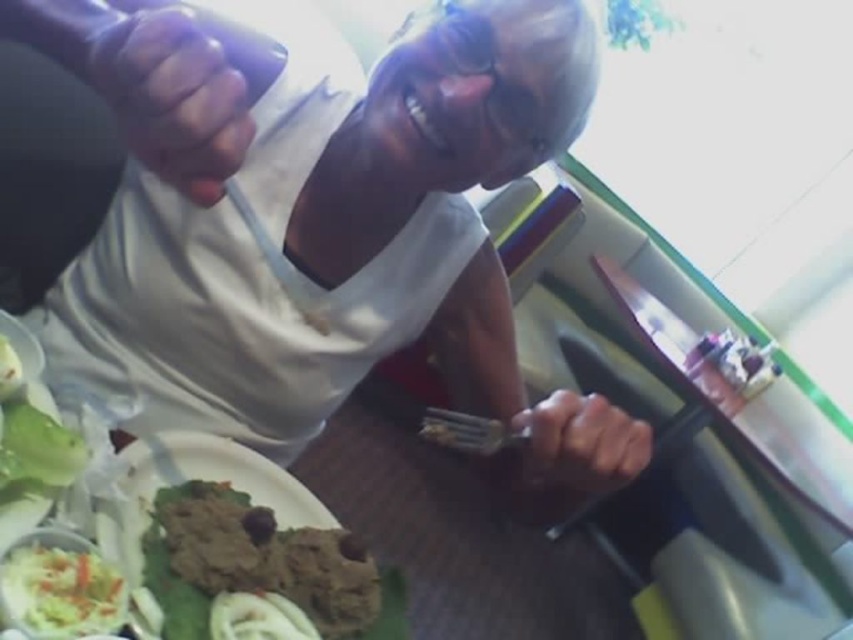
Does white matte shirt at upper center have a greater width compared to smooth skin hand at lower center?

Yes, white matte shirt at upper center is wider than smooth skin hand at lower center.

This screenshot has height=640, width=853. What do you see at coordinates (305, 205) in the screenshot? I see `white matte shirt at upper center` at bounding box center [305, 205].

Image resolution: width=853 pixels, height=640 pixels. In order to click on white matte shirt at upper center in this screenshot , I will do `click(305, 205)`.

From the picture: Can you confirm if brown matte food at lower left is smaller than wooden table at center?

Indeed, brown matte food at lower left has a smaller size compared to wooden table at center.

Does point (219, 484) come farther from viewer compared to point (808, 488)?

No, (219, 484) is in front of (808, 488).

Find the location of a particular element. The width and height of the screenshot is (853, 640). brown matte food at lower left is located at coordinates (252, 563).

Consider the image. Does smooth skin hand at center have a larger size compared to smooth skin hand at lower center?

Actually, smooth skin hand at center might be smaller than smooth skin hand at lower center.

Can you confirm if smooth skin hand at center is smaller than smooth skin hand at lower center?

Yes.

Is point (120, 52) positioned in front of point (646, 464)?

That is True.

The image size is (853, 640). What are the coordinates of `smooth skin hand at center` in the screenshot? It's located at (172, 97).